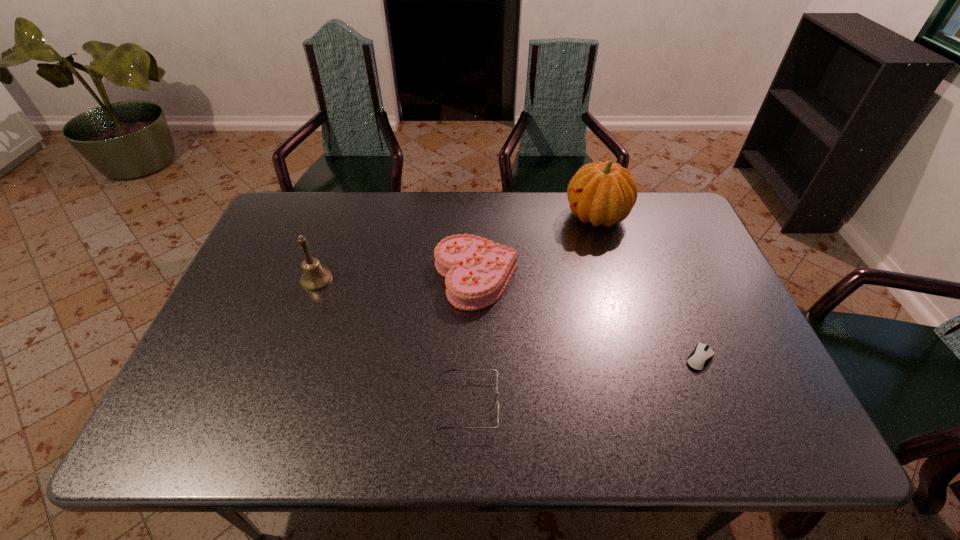
Image resolution: width=960 pixels, height=540 pixels. Find the location of `free spot at the near edge of the desktop`. free spot at the near edge of the desktop is located at coordinates (654, 427).

The width and height of the screenshot is (960, 540). In the image, there is a desktop. What are the coordinates of `free space at the left edge` in the screenshot? It's located at (265, 326).

Locate an element on the screen. free space at the right edge is located at coordinates (746, 357).

Find the location of a particular element. The width and height of the screenshot is (960, 540). blank space at the far left corner of the desktop is located at coordinates pyautogui.click(x=269, y=226).

This screenshot has height=540, width=960. I want to click on empty location between the fourth tallest object and the cake, so click(x=472, y=340).

Locate an element on the screen. empty space between the rightmost object and the fourth tallest object is located at coordinates coord(584,381).

Where is `blank region between the third shortest object and the pumpkin`? blank region between the third shortest object and the pumpkin is located at coordinates (537, 247).

This screenshot has height=540, width=960. I want to click on empty space that is in between the fourth shortest object and the mouse, so click(x=508, y=319).

Identify the location of empty space between the spectacles and the second tallest object. (392, 341).

You are a GUI agent. You are given a task and a screenshot of the screen. Output one action in this format:
    pyautogui.click(x=<x>, y=<y>)
    Task: Click on the empty space between the second tallest object and the cake
    
    Given the screenshot: What is the action you would take?
    pyautogui.click(x=396, y=278)